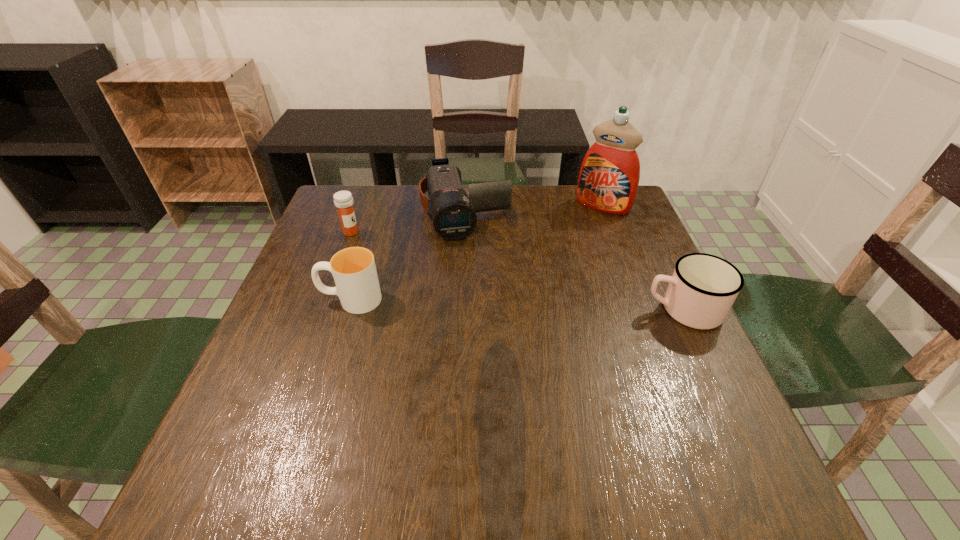
Find the location of a particular element. The height and width of the screenshot is (540, 960). camcorder at the far edge is located at coordinates (454, 215).

Image resolution: width=960 pixels, height=540 pixels. Find the location of `detergent at the far edge`. detergent at the far edge is located at coordinates (609, 176).

The height and width of the screenshot is (540, 960). Identify the location of medicine that is at the far edge. (343, 200).

I want to click on cup at the left edge, so click(x=357, y=286).

Image resolution: width=960 pixels, height=540 pixels. I want to click on medicine at the left edge, so click(x=343, y=200).

I want to click on mug that is at the right edge, so click(x=702, y=289).

Image resolution: width=960 pixels, height=540 pixels. I want to click on detergent that is at the right edge, so click(x=609, y=176).

Locate an element on the screen. Image resolution: width=960 pixels, height=540 pixels. object that is at the far left corner is located at coordinates (343, 200).

Identify the location of object present at the far right corner. Image resolution: width=960 pixels, height=540 pixels. (609, 176).

You are a GUI agent. You are given a task and a screenshot of the screen. Output one action in this format:
    pyautogui.click(x=<x>, y=<y>)
    Task: Click on the vacant space at the far edge of the desktop
    The height and width of the screenshot is (540, 960).
    Given the screenshot: What is the action you would take?
    pyautogui.click(x=407, y=209)